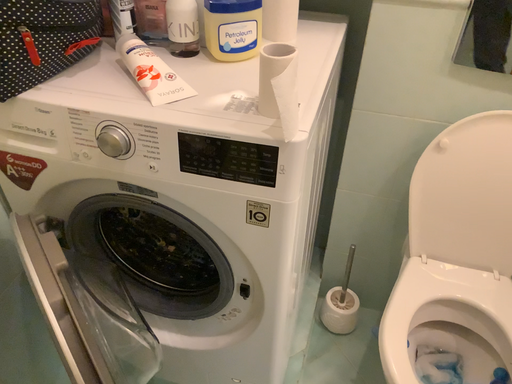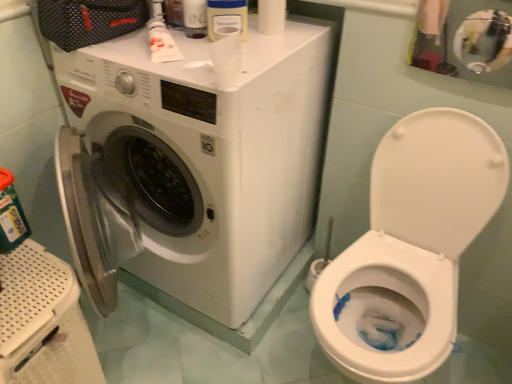
Question: How did the camera likely rotate when shooting the video?

Choices:
 (A) rotated left
 (B) rotated right

Answer: (A)